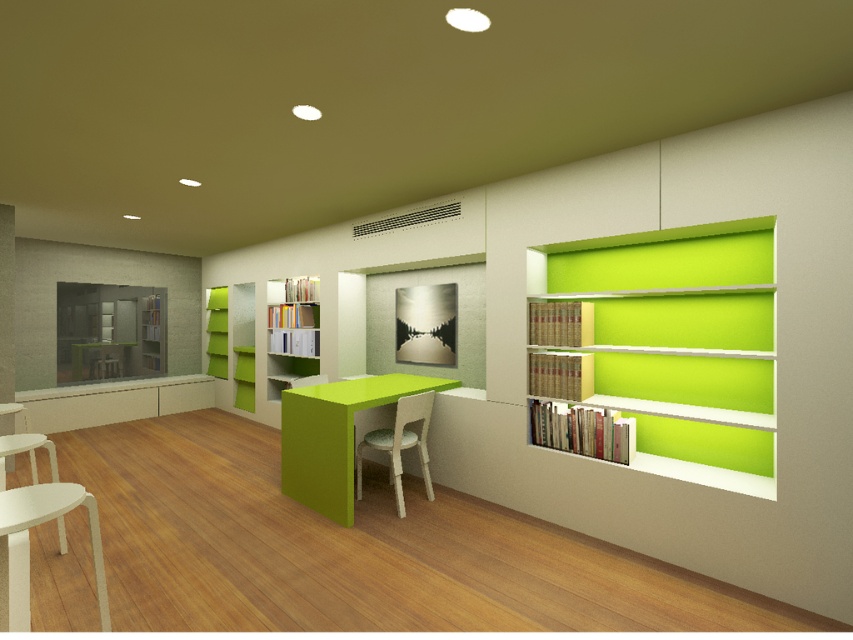
Describe the element at coordinates (672, 346) in the screenshot. The width and height of the screenshot is (853, 640). I see `lime green matte bookcase at right` at that location.

Which is in front, point (614, 291) or point (297, 378)?

Point (614, 291) is in front.

What do you see at coordinates (672, 346) in the screenshot?
I see `lime green matte bookcase at right` at bounding box center [672, 346].

Find the location of a particular element. The width and height of the screenshot is (853, 640). lime green matte bookcase at right is located at coordinates coord(672,346).

Is matte green table at center bigger than white textured chair at center?

Yes, matte green table at center is bigger than white textured chair at center.

Consider the image. Can you confirm if matte green table at center is positioned below white textured chair at center?

Actually, matte green table at center is above white textured chair at center.

Find the location of a particular element. The image size is (853, 640). matte green table at center is located at coordinates (334, 436).

Looking at this image, can you confirm if white textured chair at center is smaller than green matte bookcase at left?

No.

Is white textured chair at center shorter than green matte bookcase at left?

Indeed, white textured chair at center has a lesser height compared to green matte bookcase at left.

Which is in front, point (393, 476) or point (212, 349)?

Positioned in front is point (393, 476).

This screenshot has width=853, height=640. Find the location of `white textured chair at center`. white textured chair at center is located at coordinates (399, 444).